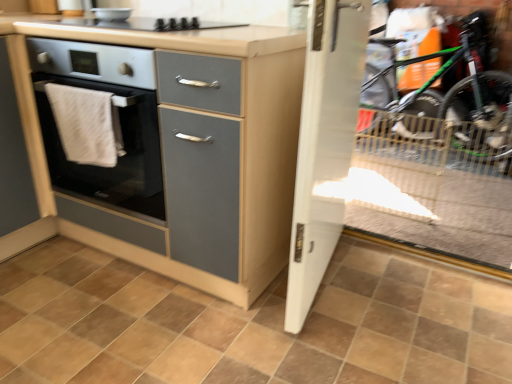
Question: In terms of height, does brown matte tile at center look taller or shorter compared to white glossy door at center?

Choices:
 (A) short
 (B) tall

Answer: (A)

Question: Relative to white glossy door at center, is brown matte tile at center in front or behind?

Choices:
 (A) behind
 (B) front

Answer: (B)

Question: Considering the real-world distances, which object is farthest from the matte gray cabinet at left?

Choices:
 (A) white glossy door at center
 (B) green matte mountain bike at right
 (C) white cloth at left
 (D) transparent glass door at right
 (E) white glossy bowl at upper center

Answer: (B)

Question: Which object is positioned closest to the white glossy door at center?

Choices:
 (A) brown matte tile at center
 (B) green matte mountain bike at right
 (C) matte gray cabinet at left
 (D) transparent glass door at right
 (E) white glossy bowl at upper center

Answer: (A)